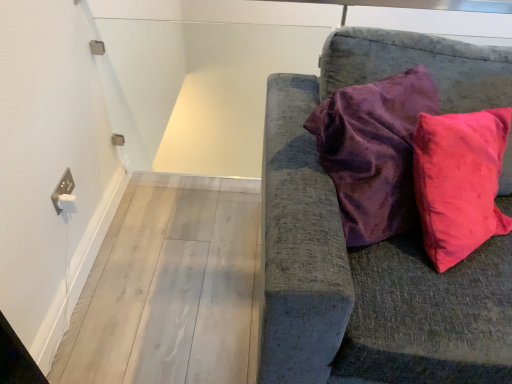
This screenshot has width=512, height=384. Identify the location of velvet couch at right. (378, 244).

What is the approximate width of velvet couch at right?

3.46 feet.

Measure the distance between velvet couch at right and camera.

velvet couch at right and camera are 33.40 inches apart.

The image size is (512, 384). What do you see at coordinates (378, 244) in the screenshot? I see `velvet couch at right` at bounding box center [378, 244].

Consider the image. Measure the distance between point (327,42) and camera.

Point (327,42) is 4.39 feet away from camera.

Where is `velvet couch at right`? velvet couch at right is located at coordinates (378, 244).